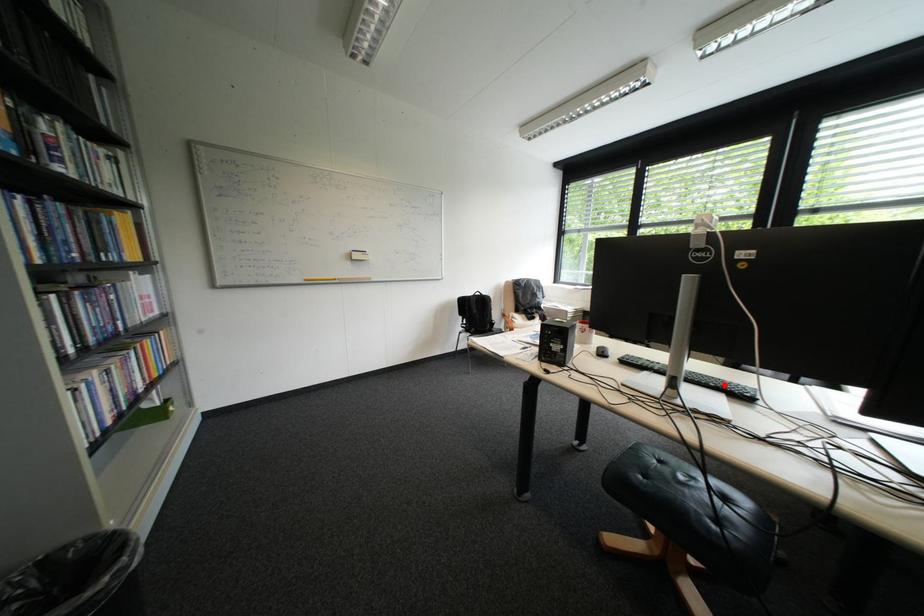
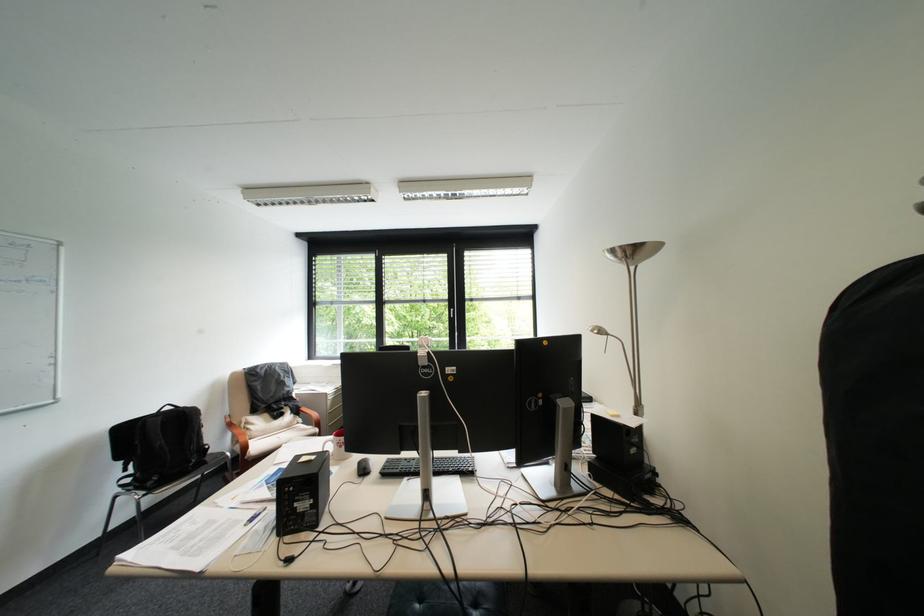
The point at the highlighted location is marked in the first image. Where is the corresponding point in the second image?

(463, 469)